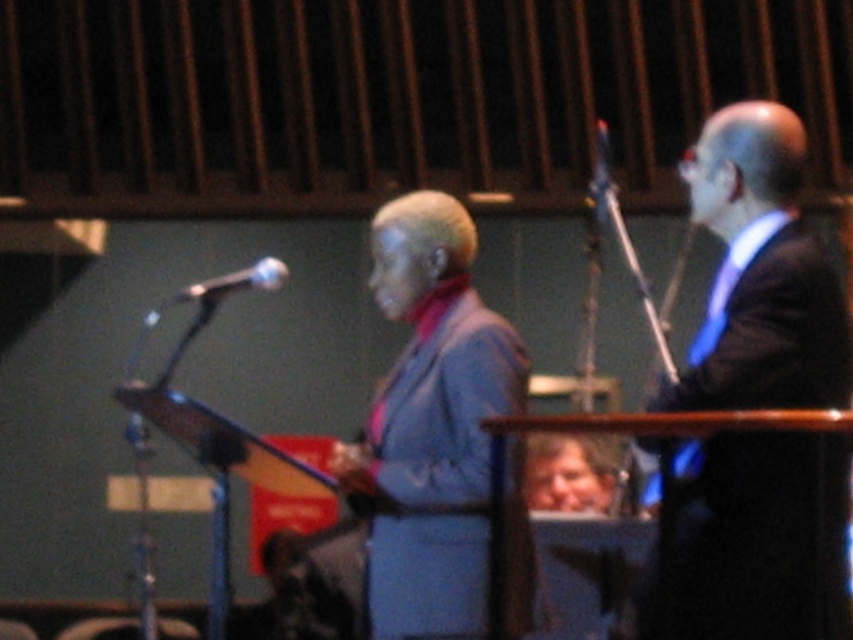
Question: Which object is the farthest from the matte silver microphone at left?

Choices:
 (A) matte blue suit at center
 (B) dark blue suit at right

Answer: (B)

Question: Among these points, which one is nearest to the camera?

Choices:
 (A) (265, 269)
 (B) (785, 584)
 (C) (518, 609)

Answer: (B)

Question: Which of the following is the closest to the observer?

Choices:
 (A) (480, 349)
 (B) (265, 269)

Answer: (A)

Question: Can you confirm if matte blue suit at center is positioned above matte silver microphone at left?

Choices:
 (A) no
 (B) yes

Answer: (A)

Question: Does dark blue suit at right have a smaller size compared to matte blue suit at center?

Choices:
 (A) yes
 (B) no

Answer: (A)

Question: Does matte blue suit at center appear on the right side of matte silver microphone at left?

Choices:
 (A) no
 (B) yes

Answer: (B)